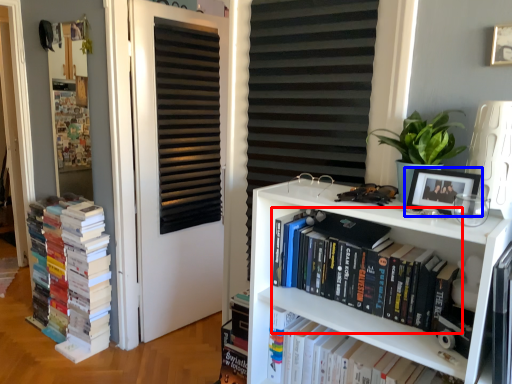
Question: Which point is further to the camera, book (highlighted by a red box) or picture frame (highlighted by a blue box)?

Choices:
 (A) book
 (B) picture frame

Answer: (A)